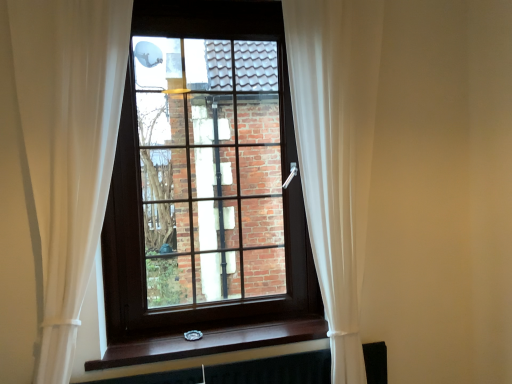
What do you see at coordinates (64, 143) in the screenshot?
I see `white sheer curtain at center, which ranks as the second curtain in right-to-left order` at bounding box center [64, 143].

Describe the element at coordinates (336, 152) in the screenshot. The width and height of the screenshot is (512, 384). I see `white sheer curtain at right, the second curtain positioned from the left` at that location.

The width and height of the screenshot is (512, 384). What do you see at coordinates (207, 183) in the screenshot? I see `brown wooden window at center` at bounding box center [207, 183].

What are the coordinates of `white sheer curtain at center, acting as the first curtain starting from the left` in the screenshot? It's located at (64, 143).

Is white sheer curtain at center, which ranks as the second curtain in right-to-left order, oriented away from brown wooden window at center?

That's not correct — white sheer curtain at center, which ranks as the second curtain in right-to-left order, is not looking away from brown wooden window at center.

From a real-world perspective, is white sheer curtain at center, acting as the first curtain starting from the left, under brown wooden window at center?

Yes.

Is white sheer curtain at center, acting as the first curtain starting from the left, next to brown wooden window at center?

white sheer curtain at center, acting as the first curtain starting from the left, is not next to brown wooden window at center, and they're not touching.

Would you say white sheer curtain at center, which ranks as the second curtain in right-to-left order, contains brown wooden window at center?

Actually, brown wooden window at center is outside white sheer curtain at center, which ranks as the second curtain in right-to-left order.

Where is `curtain on the right of the black matte radiator at bottom`? Image resolution: width=512 pixels, height=384 pixels. curtain on the right of the black matte radiator at bottom is located at coordinates (336, 152).

Who is smaller, white sheer curtain at right, placed as the 1th curtain when sorted from right to left, or black matte radiator at bottom?

With smaller size is black matte radiator at bottom.

From the image's perspective, which object appears higher, white sheer curtain at right, the second curtain positioned from the left, or black matte radiator at bottom?

white sheer curtain at right, the second curtain positioned from the left, from the image's perspective.

Is white sheer curtain at right, placed as the 1th curtain when sorted from right to left, aimed at black matte radiator at bottom?

No, white sheer curtain at right, placed as the 1th curtain when sorted from right to left, is not facing towards black matte radiator at bottom.

Where is `window located above the brown wood at lower center (from the image's perspective)`? window located above the brown wood at lower center (from the image's perspective) is located at coordinates (207, 183).

Which of these two, brown wood at lower center or brown wooden window at center, stands shorter?

brown wood at lower center.

Does brown wood at lower center turn towards brown wooden window at center?

No, brown wood at lower center is not facing towards brown wooden window at center.

Considering the sizes of objects brown wood at lower center and brown wooden window at center in the image provided, who is thinner, brown wood at lower center or brown wooden window at center?

brown wooden window at center is thinner.

From a real-world perspective, is black matte radiator at bottom physically above brown wooden window at center?

Actually, black matte radiator at bottom is physically below brown wooden window at center in the real world.

Which is more distant, (257, 377) or (248, 220)?

The point (248, 220) is farther from the camera.

Locate an element on the screen. The image size is (512, 384). window above the black matte radiator at bottom (from the image's perspective) is located at coordinates (207, 183).

Is black matte radiator at bottom outside of brown wooden window at center?

black matte radiator at bottom is positioned outside brown wooden window at center.

Is white sheer curtain at center, which ranks as the second curtain in right-to-left order, directly adjacent to white sheer curtain at right, placed as the 1th curtain when sorted from right to left?

No, white sheer curtain at center, which ranks as the second curtain in right-to-left order, is not beside white sheer curtain at right, placed as the 1th curtain when sorted from right to left.

From a real-world perspective, is white sheer curtain at center, which ranks as the second curtain in right-to-left order, physically located above or below white sheer curtain at right, the second curtain positioned from the left?

white sheer curtain at center, which ranks as the second curtain in right-to-left order, is above white sheer curtain at right, the second curtain positioned from the left.

Considering the relative positions of white sheer curtain at center, which ranks as the second curtain in right-to-left order, and white sheer curtain at right, placed as the 1th curtain when sorted from right to left, in the image provided, is white sheer curtain at center, which ranks as the second curtain in right-to-left order, to the left or to the right of white sheer curtain at right, placed as the 1th curtain when sorted from right to left,?

In the image, white sheer curtain at center, which ranks as the second curtain in right-to-left order, appears on the left side of white sheer curtain at right, placed as the 1th curtain when sorted from right to left.

Can you confirm if white sheer curtain at center, acting as the first curtain starting from the left, is shorter than white sheer curtain at right, the second curtain positioned from the left?

Indeed, white sheer curtain at center, acting as the first curtain starting from the left, has a lesser height compared to white sheer curtain at right, the second curtain positioned from the left.

Between white sheer curtain at right, placed as the 1th curtain when sorted from right to left, and white sheer curtain at center, acting as the first curtain starting from the left, which one appears on the right side from the viewer's perspective?

white sheer curtain at right, placed as the 1th curtain when sorted from right to left, is more to the right.

Is white sheer curtain at right, the second curtain positioned from the left, facing away from white sheer curtain at center, acting as the first curtain starting from the left?

No, white sheer curtain at center, acting as the first curtain starting from the left, is not at the back of white sheer curtain at right, the second curtain positioned from the left.

I want to click on curtain below the white sheer curtain at center, acting as the first curtain starting from the left (from a real-world perspective), so click(x=336, y=152).

Is white sheer curtain at right, placed as the 1th curtain when sorted from right to left, placed right next to white sheer curtain at center, which ranks as the second curtain in right-to-left order?

There is a gap between white sheer curtain at right, placed as the 1th curtain when sorted from right to left, and white sheer curtain at center, which ranks as the second curtain in right-to-left order.

Does brown wooden window at center appear on the right side of brown wood at lower center?

In fact, brown wooden window at center is to the left of brown wood at lower center.

From the image's perspective, between brown wooden window at center and brown wood at lower center, who is located below?

brown wood at lower center appears lower in the image.

Are brown wooden window at center and brown wood at lower center located far from each other?

No.

Find the location of a particular element. This screenshot has width=512, height=384. window behind the white sheer curtain at center, which ranks as the second curtain in right-to-left order is located at coordinates tap(207, 183).

From a real-world perspective, which curtain is the 1st one above the black matte radiator at bottom? Please provide its 2D coordinates.

[(336, 152)]

Based on their spatial positions, is brown wood at lower center or brown wooden window at center further from black matte radiator at bottom?

brown wooden window at center is further to black matte radiator at bottom.

Looking at the image, which one is located further to white sheer curtain at right, placed as the 1th curtain when sorted from right to left, black matte radiator at bottom or white sheer curtain at center, which ranks as the second curtain in right-to-left order?

The object further to white sheer curtain at right, placed as the 1th curtain when sorted from right to left, is white sheer curtain at center, which ranks as the second curtain in right-to-left order.

When comparing their distances from white sheer curtain at center, which ranks as the second curtain in right-to-left order, does black matte radiator at bottom or brown wooden window at center seem closer?

brown wooden window at center is positioned closer to the anchor white sheer curtain at center, which ranks as the second curtain in right-to-left order.

From the image, which object appears to be nearer to white sheer curtain at right, placed as the 1th curtain when sorted from right to left, brown wooden window at center or white sheer curtain at center, acting as the first curtain starting from the left?

brown wooden window at center is positioned closer to the anchor white sheer curtain at right, placed as the 1th curtain when sorted from right to left.

Considering their positions, is brown wood at lower center positioned closer to brown wooden window at center than black matte radiator at bottom?

Based on the image, brown wood at lower center appears to be nearer to brown wooden window at center.

From the picture: From the image, which object appears to be nearer to brown wooden window at center, black matte radiator at bottom or white sheer curtain at right, placed as the 1th curtain when sorted from right to left?

white sheer curtain at right, placed as the 1th curtain when sorted from right to left, is closer to brown wooden window at center.

Estimate the real-world distances between objects in this image. Which object is further from brown wood at lower center, white sheer curtain at right, placed as the 1th curtain when sorted from right to left, or white sheer curtain at center, which ranks as the second curtain in right-to-left order?

white sheer curtain at right, placed as the 1th curtain when sorted from right to left.

Which object lies nearer to the anchor point white sheer curtain at center, acting as the first curtain starting from the left, black matte radiator at bottom or brown wood at lower center?

brown wood at lower center.

Find the location of a particular element. window located between white sheer curtain at center, acting as the first curtain starting from the left, and white sheer curtain at right, placed as the 1th curtain when sorted from right to left, in the left-right direction is located at coordinates (207, 183).

The width and height of the screenshot is (512, 384). I want to click on window sill between white sheer curtain at center, which ranks as the second curtain in right-to-left order, and black matte radiator at bottom in the up-down direction, so click(210, 342).

Locate an element on the screen. window sill between white sheer curtain at center, acting as the first curtain starting from the left, and white sheer curtain at right, the second curtain positioned from the left, in the horizontal direction is located at coordinates (210, 342).

The width and height of the screenshot is (512, 384). I want to click on window sill between white sheer curtain at right, the second curtain positioned from the left, and black matte radiator at bottom from top to bottom, so click(210, 342).